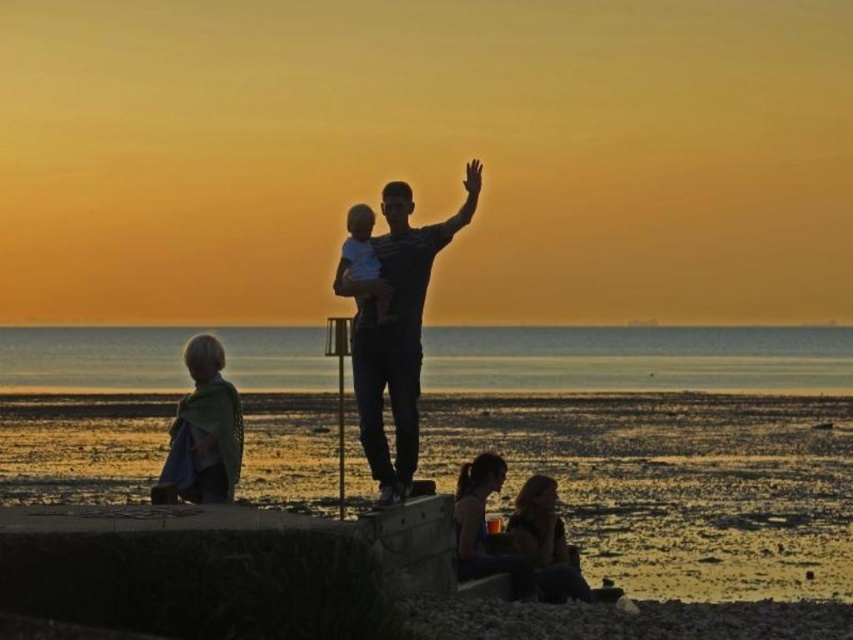
Between point (383, 493) and point (558, 572), which one is positioned behind?

The point (558, 572) is behind.

Image resolution: width=853 pixels, height=640 pixels. What do you see at coordinates (396, 328) in the screenshot?
I see `matte black shirt at center` at bounding box center [396, 328].

Who is more forward, [408,296] or [479,561]?

Positioned in front is point [408,296].

Where is `matte black shirt at center`? This screenshot has height=640, width=853. matte black shirt at center is located at coordinates (396, 328).

Can you confirm if smooth leather jacket at lower right is positioned to the left of smooth white baby at center?

No, smooth leather jacket at lower right is not to the left of smooth white baby at center.

Is smooth leather jacket at lower right shorter than smooth white baby at center?

Indeed, smooth leather jacket at lower right has a lesser height compared to smooth white baby at center.

What are the coordinates of `smooth leather jacket at lower right` in the screenshot? It's located at (511, 538).

This screenshot has height=640, width=853. Describe the element at coordinates (511, 538) in the screenshot. I see `smooth leather jacket at lower right` at that location.

Is smooth leather jacket at lower right to the right of blonde hair fabric child at lower left from the viewer's perspective?

Indeed, smooth leather jacket at lower right is positioned on the right side of blonde hair fabric child at lower left.

The image size is (853, 640). Find the location of `smooth leather jacket at lower right`. smooth leather jacket at lower right is located at coordinates [x=511, y=538].

Identify the location of smooth leather jacket at lower right. Image resolution: width=853 pixels, height=640 pixels. (511, 538).